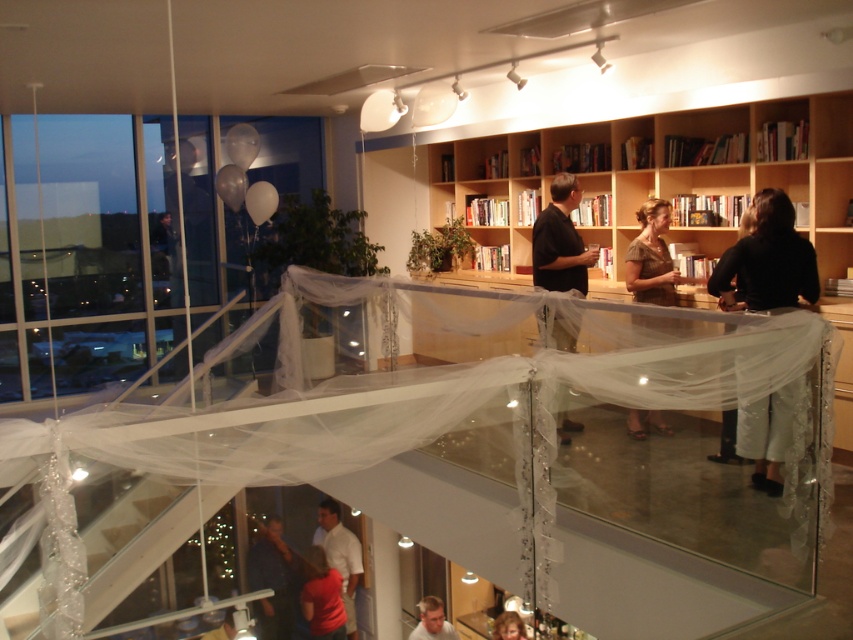
From the picture: You are an interior designer planning to hang a decorative item between the black fabric pants at right and the matte red shirt at lower center. Which object should you place the item closer to if you want it to appear balanced in terms of visual weight?

The black fabric pants at right has a smaller size compared to matte red shirt at lower center, so to balance visual weight, the decorative item should be placed closer to the black fabric pants at right to compensate for its smaller size.